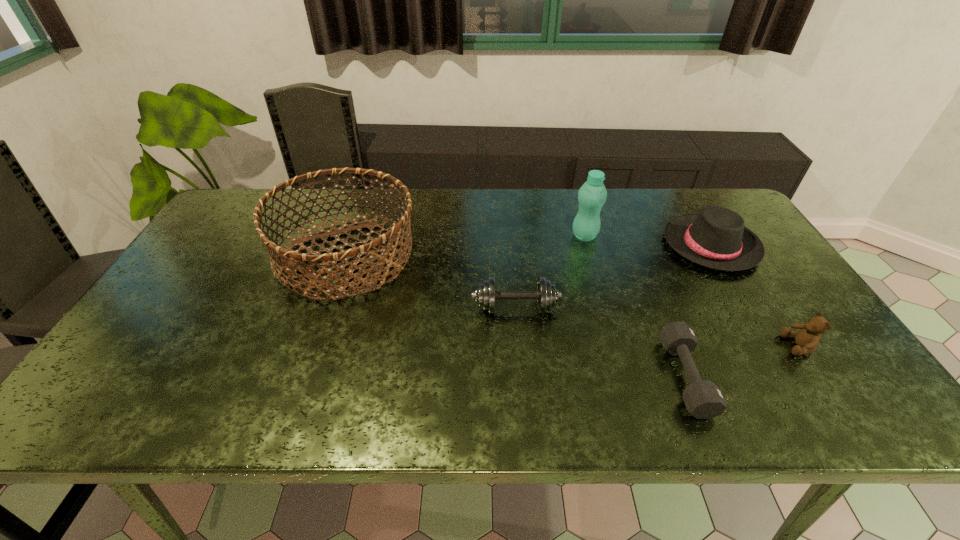
The width and height of the screenshot is (960, 540). Identify the location of dress hat present at the far edge. (716, 238).

Identify the location of object located in the near edge section of the desktop. (703, 399).

The image size is (960, 540). In order to click on dress hat that is at the right edge in this screenshot , I will do `click(716, 238)`.

This screenshot has width=960, height=540. What are the coordinates of `teddy bear at the right edge` in the screenshot? It's located at (807, 340).

Locate an element on the screen. object at the far right corner is located at coordinates (716, 238).

The width and height of the screenshot is (960, 540). I want to click on vacant area at the far edge, so click(x=621, y=200).

This screenshot has height=540, width=960. Identify the location of vacant space at the near edge of the desktop. (393, 395).

Where is `blank space at the left edge`? This screenshot has width=960, height=540. blank space at the left edge is located at coordinates (205, 242).

The image size is (960, 540). Find the location of `free space at the right edge of the desktop`. free space at the right edge of the desktop is located at coordinates (851, 379).

Where is `free location at the far right corner of the desktop`? This screenshot has width=960, height=540. free location at the far right corner of the desktop is located at coordinates (694, 208).